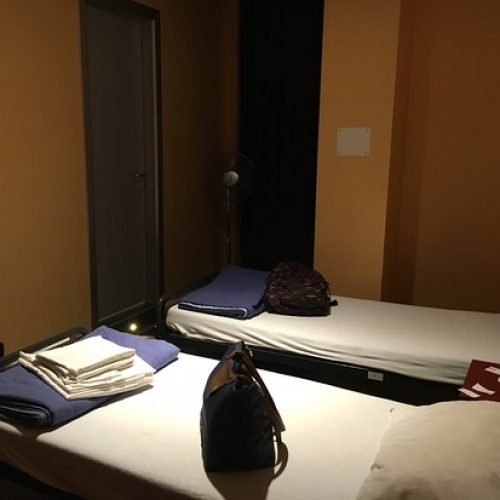
I want to click on fan, so click(234, 177).